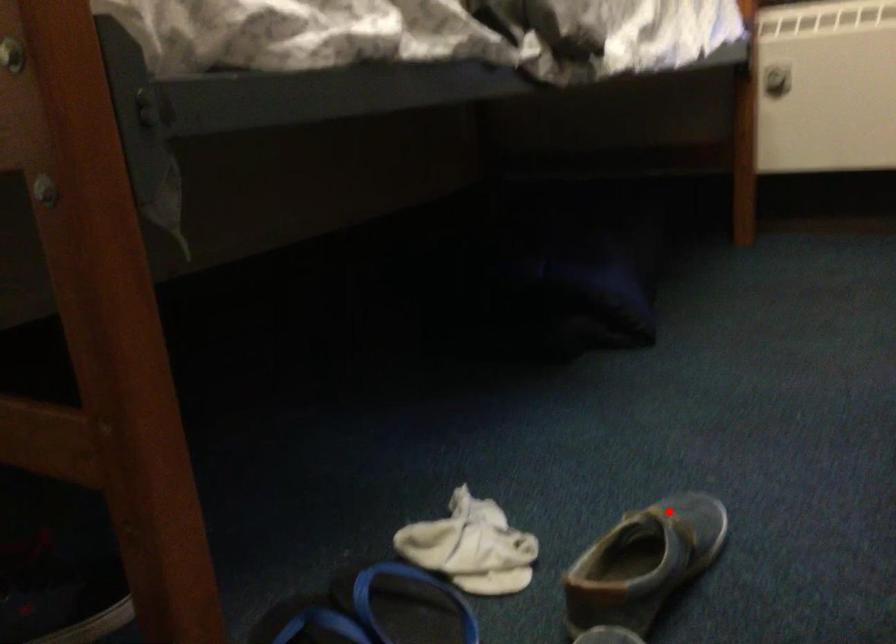
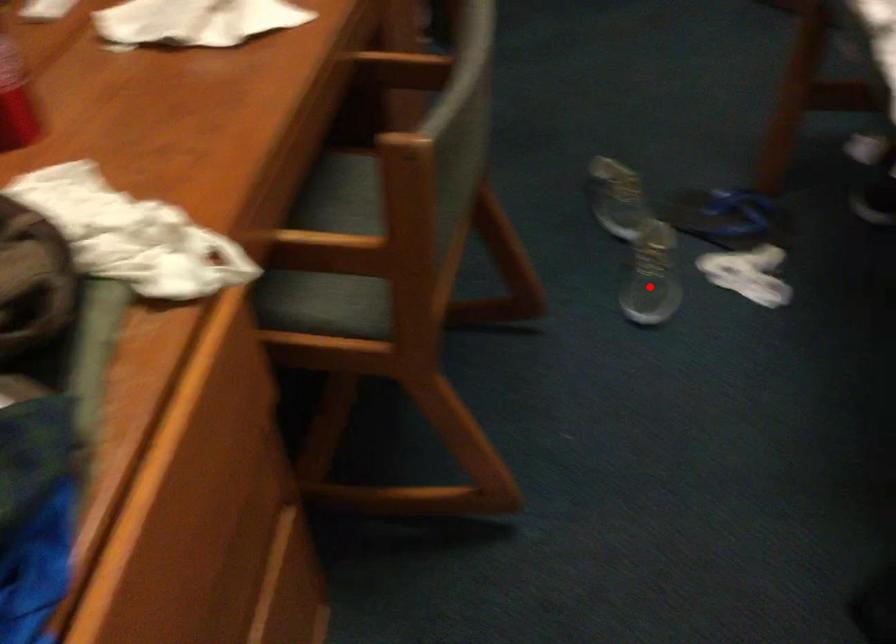
From the picture: I am providing you with two images of the same scene from different viewpoints. A red point is marked on the first image and another point is marked on the second image. Is the red point in image1 aligned with the point shown in image2?

Yes